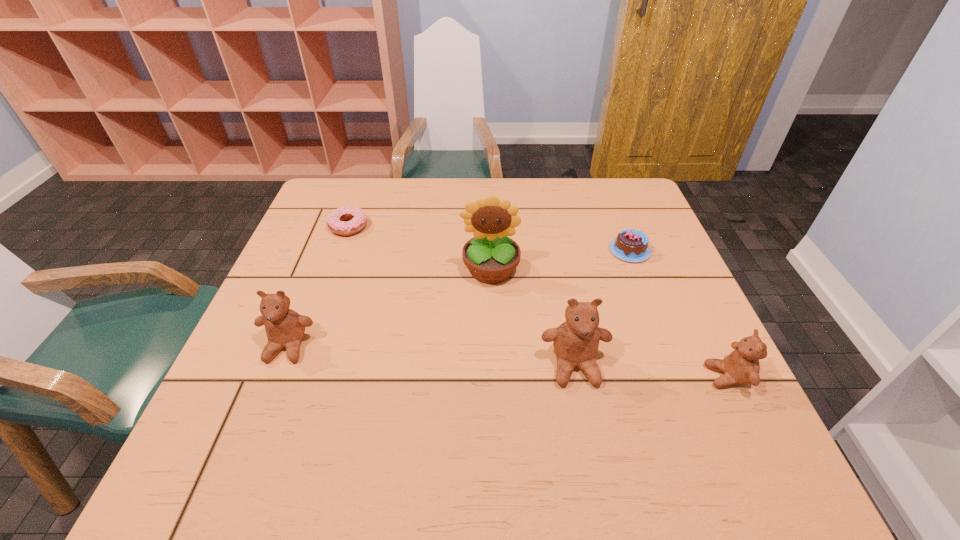
Find the location of a particular element. the second shortest teddy bear is located at coordinates (285, 328).

Locate an element on the screen. the leftmost teddy bear is located at coordinates (285, 328).

I want to click on the fourth object from left to right, so click(576, 341).

The height and width of the screenshot is (540, 960). Identify the location of the rightmost teddy bear. (741, 366).

Identify the location of the third shortest object. The width and height of the screenshot is (960, 540). (741, 366).

At what (x,y) coordinates should I click in order to perform the action: click on sunflower. Please return your answer as a coordinate pair (x, y). This screenshot has height=540, width=960. Looking at the image, I should click on (491, 256).

The height and width of the screenshot is (540, 960). In order to click on the tallest object in this screenshot , I will do `click(491, 256)`.

At what (x,y) coordinates should I click in order to perform the action: click on doughnut. Please return your answer as a coordinate pair (x, y). Looking at the image, I should click on (358, 220).

Where is `the fifth tallest object`? the fifth tallest object is located at coordinates (630, 245).

Locate an element on the screen. Image resolution: width=960 pixels, height=540 pixels. the fifth object from left to right is located at coordinates [x=630, y=245].